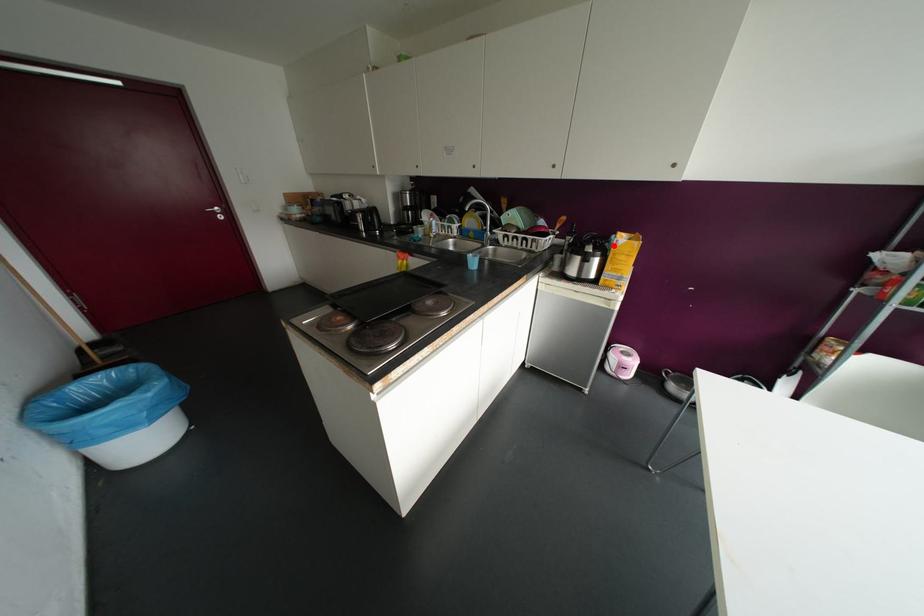
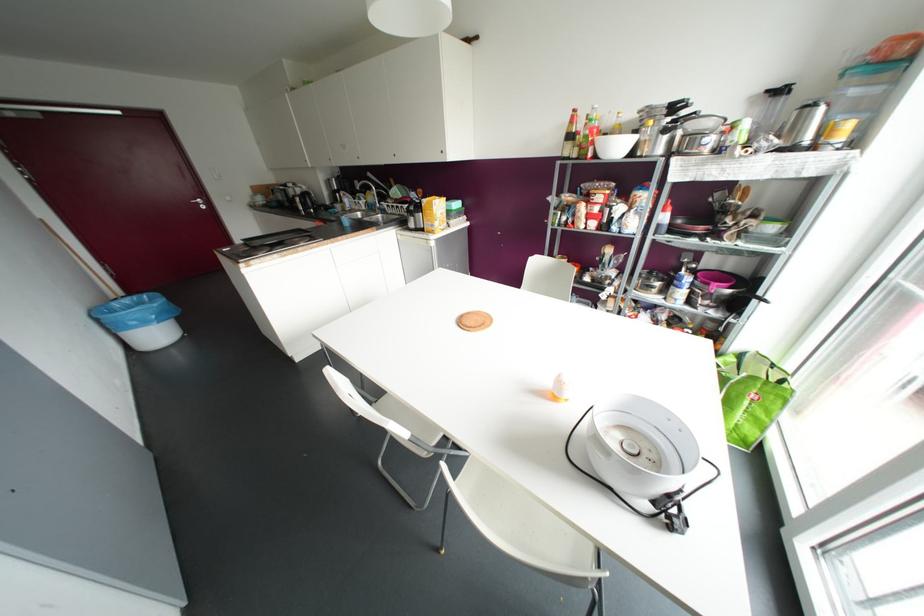
Question: A red point is marked in image1. In image2, is the corresponding 3D point closer to the camera or farther? Reply with the corresponding letter.

Choices:
 (A) The corresponding 3D point is closer.
 (B) The corresponding 3D point is farther.

Answer: (A)